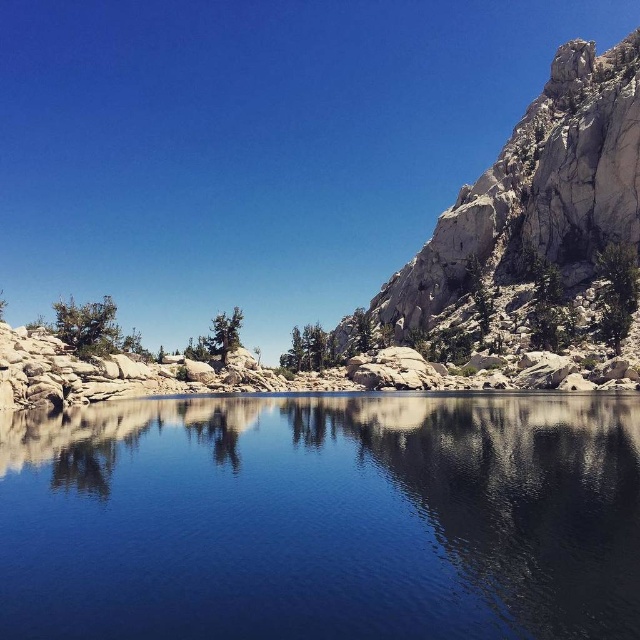
Does transparent glass water at center appear on the right side of rugged stone mountain at right?

In fact, transparent glass water at center is to the left of rugged stone mountain at right.

Which is above, transparent glass water at center or rugged stone mountain at right?

rugged stone mountain at right is above.

Who is more forward, (424, 412) or (576, 125)?

Point (424, 412)

Find the location of `transparent glass water at center`. transparent glass water at center is located at coordinates (323, 518).